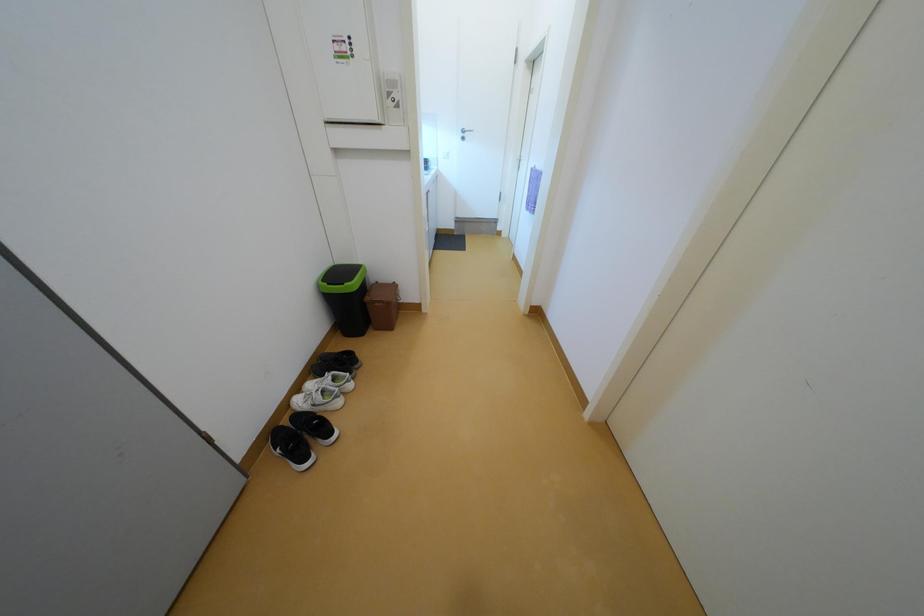
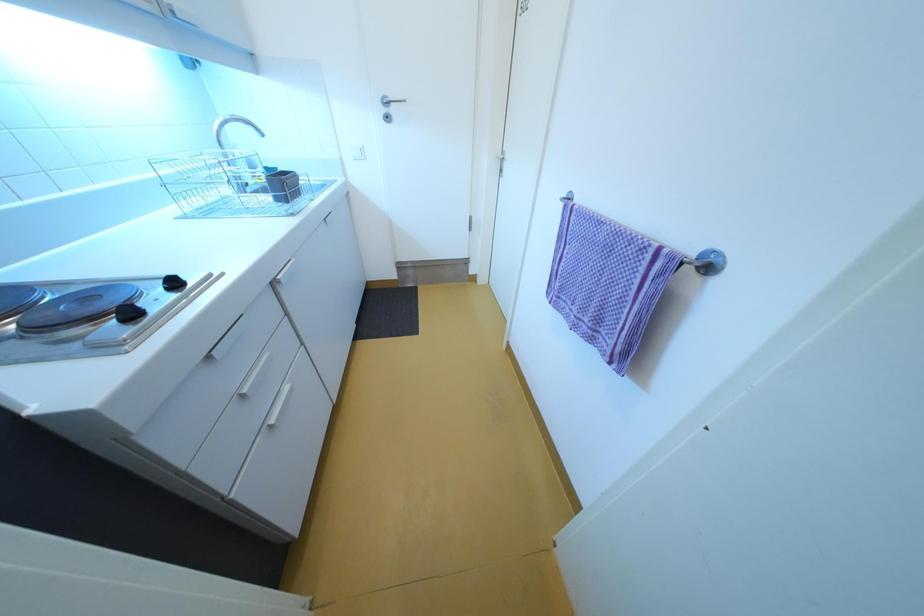
Question: What movement of the cameraman would produce the second image?

Choices:
 (A) Left
 (B) Right
 (C) Forward
 (D) Backward

Answer: (C)